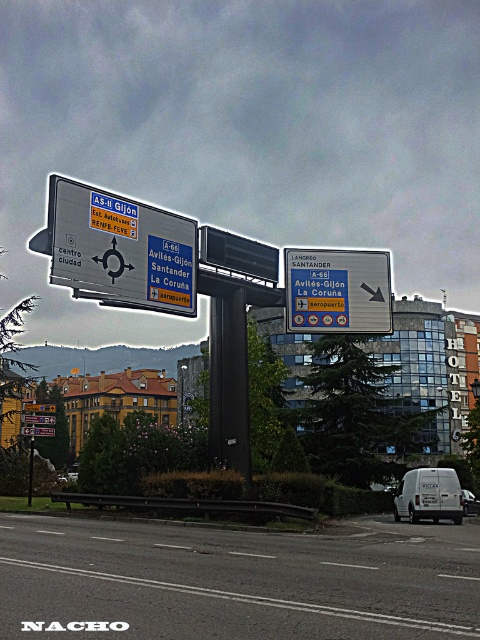
Who is more forward, (61, 266) or (29, 470)?

Positioned in front is point (61, 266).

Between metallic silver sign at center and metallic pole at center, which one has more height?

With more height is metallic silver sign at center.

Who is more forward, (153, 205) or (32, 444)?

Point (32, 444) is more forward.

The height and width of the screenshot is (640, 480). Identify the location of metallic silver sign at center. (120, 250).

Does blue plastic sign at center have a smaller size compared to white matte van at lower right?

No, blue plastic sign at center is not smaller than white matte van at lower right.

Can you confirm if blue plastic sign at center is shorter than white matte van at lower right?

No.

Between point (382, 269) and point (398, 493), which one is positioned behind?

Point (382, 269)

Locate an element on the screen. The image size is (480, 640). blue plastic sign at center is located at coordinates (337, 291).

Who is shorter, blue plastic sign at center or white matte van at center?

white matte van at center

Which is behind, point (351, 266) or point (479, 506)?

Positioned behind is point (479, 506).

This screenshot has width=480, height=640. I want to click on blue plastic sign at center, so click(x=337, y=291).